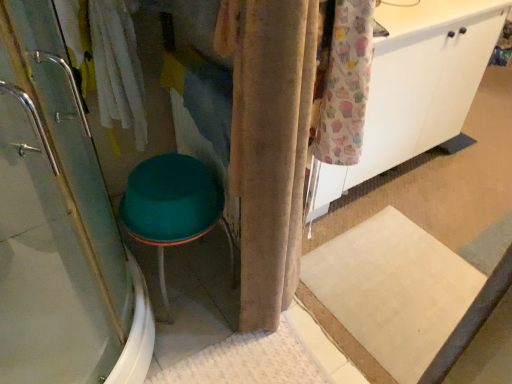
This screenshot has height=384, width=512. What are the coordinates of `vacant space that is to the left of velvet beige curtain at center` in the screenshot? It's located at (205, 318).